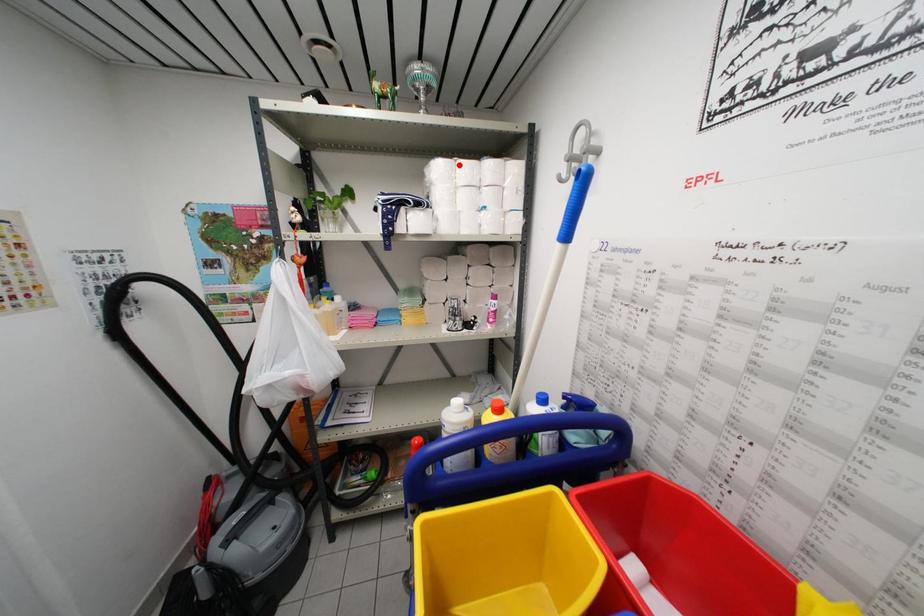
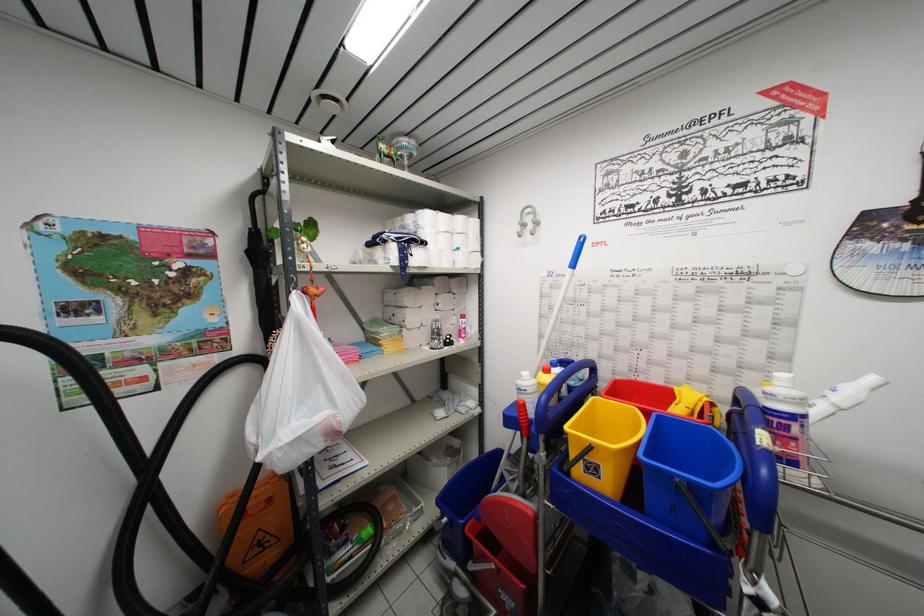
Question: I am providing you with two images of the same scene from different viewpoints. A red point is marked on the first image. Can you still see the location of the red point in image 2?

Choices:
 (A) Yes
 (B) No

Answer: (A)